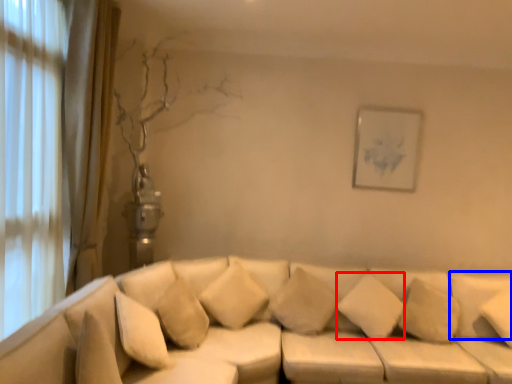
Question: Which object appears closest to the camera in this image, pillow (highlighted by a red box) or pillow (highlighted by a blue box)?

Choices:
 (A) pillow
 (B) pillow

Answer: (B)